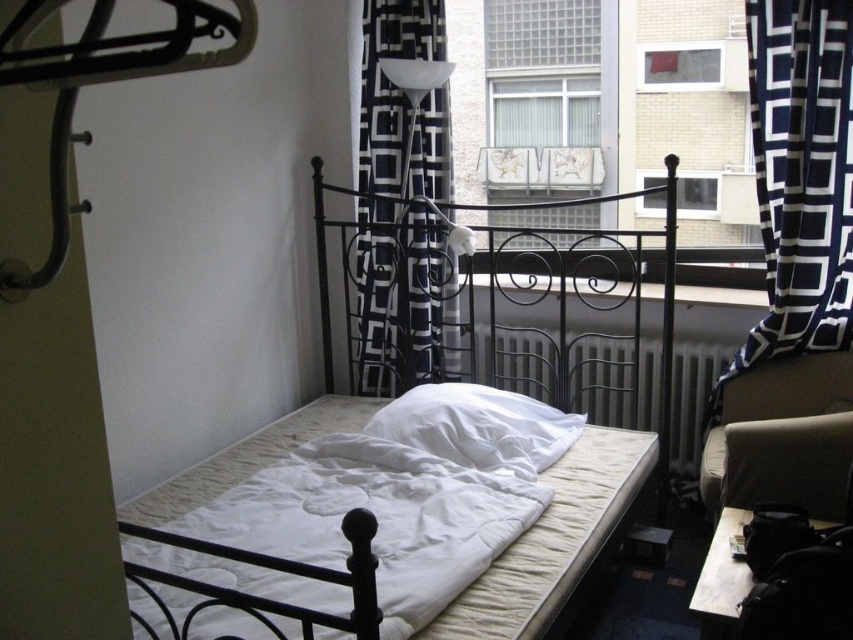
Question: Can you confirm if clear glass window at upper center is positioned to the right of suede-like beige armchair at lower right?

Choices:
 (A) yes
 (B) no

Answer: (B)

Question: Which of these objects is positioned closest to the glass window at upper center?

Choices:
 (A) white fabric bed at center
 (B) transparent glass window at upper center

Answer: (B)

Question: From the image, what is the correct spatial relationship of white fabric bed at center in relation to transparent glass window at upper center?

Choices:
 (A) below
 (B) above

Answer: (A)

Question: Among these points, which one is nearest to the camera?

Choices:
 (A) (579, 164)
 (B) (647, 355)
 (C) (351, 529)

Answer: (C)

Question: Which is nearer to the clear glass window at upper center?

Choices:
 (A) black/white geometric fabric at center
 (B) transparent glass window at upper center
 (C) white matte radiator at center
 (D) white soft pillow at center

Answer: (B)

Question: Is clear glass window at upper center positioned before suede-like beige armchair at lower right?

Choices:
 (A) no
 (B) yes

Answer: (A)